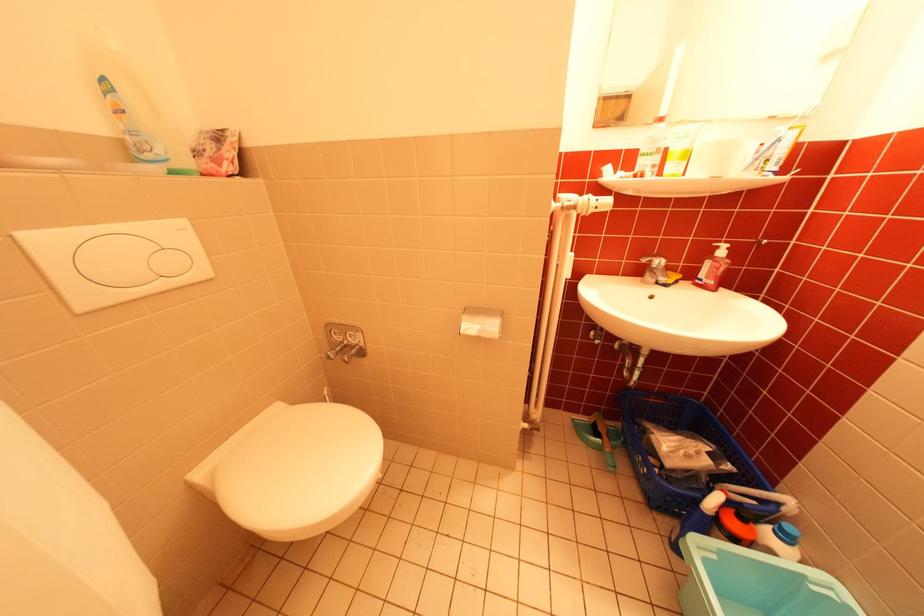
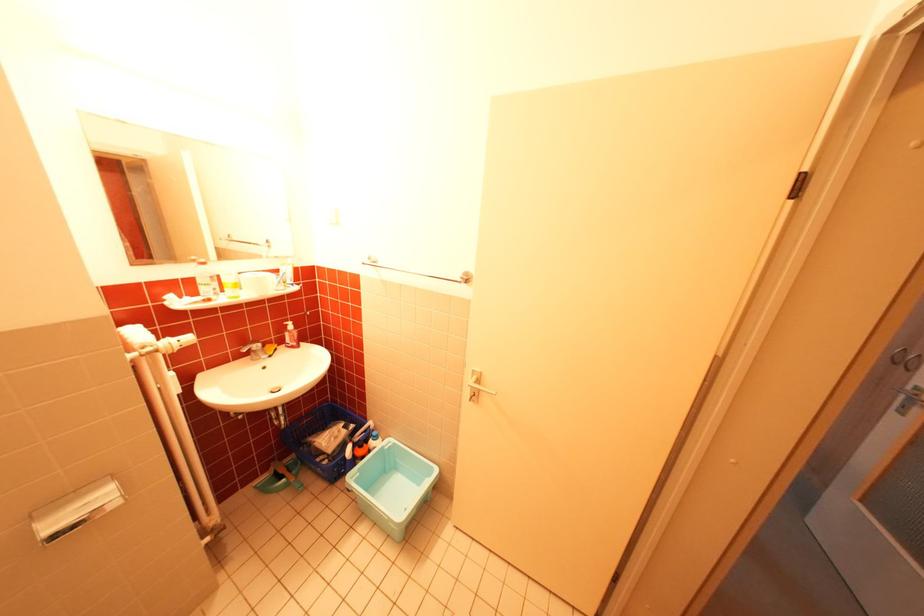
Where in the second image is the point corresponding to [608,201] from the first image?

(189, 342)